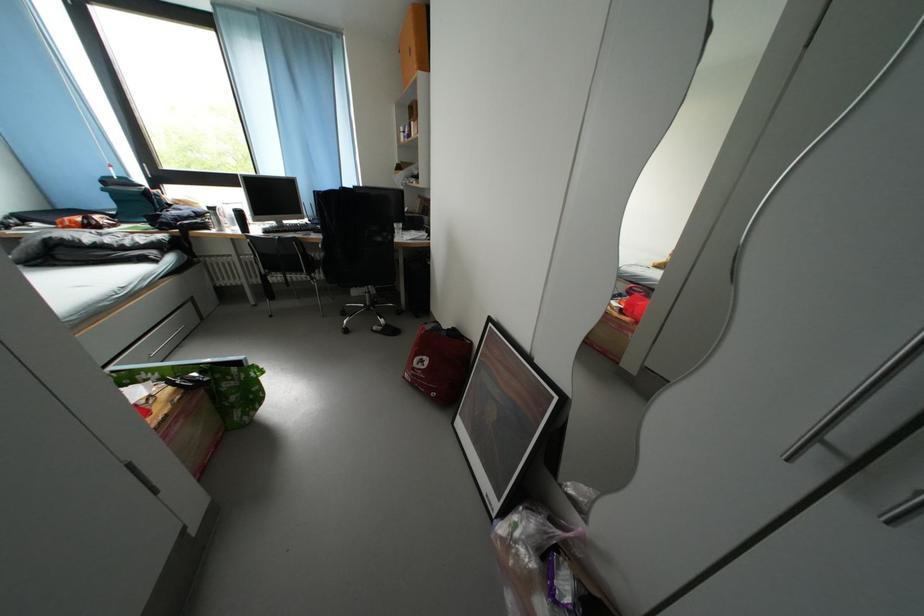
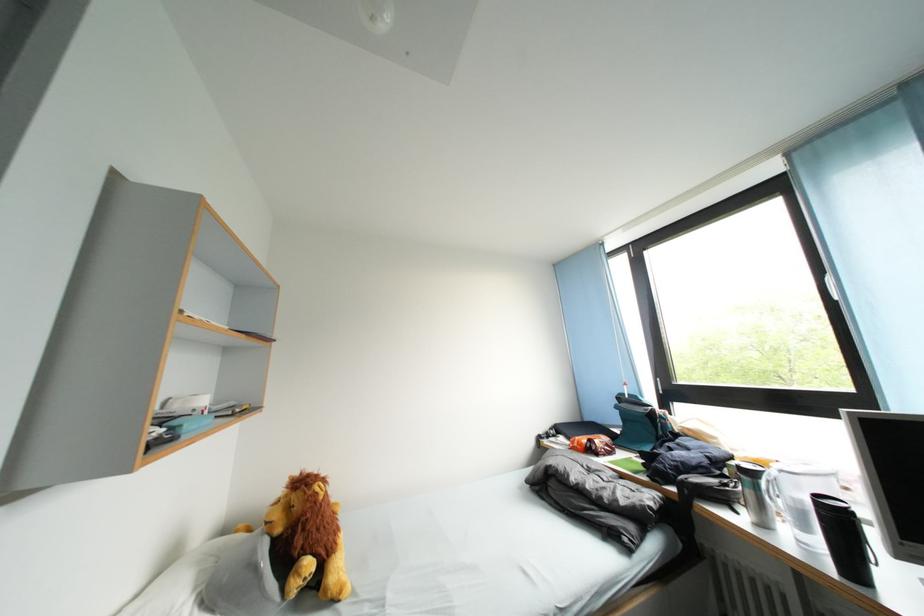
In the second image, find the point that corresponds to (x=100, y=231) in the first image.

(600, 455)